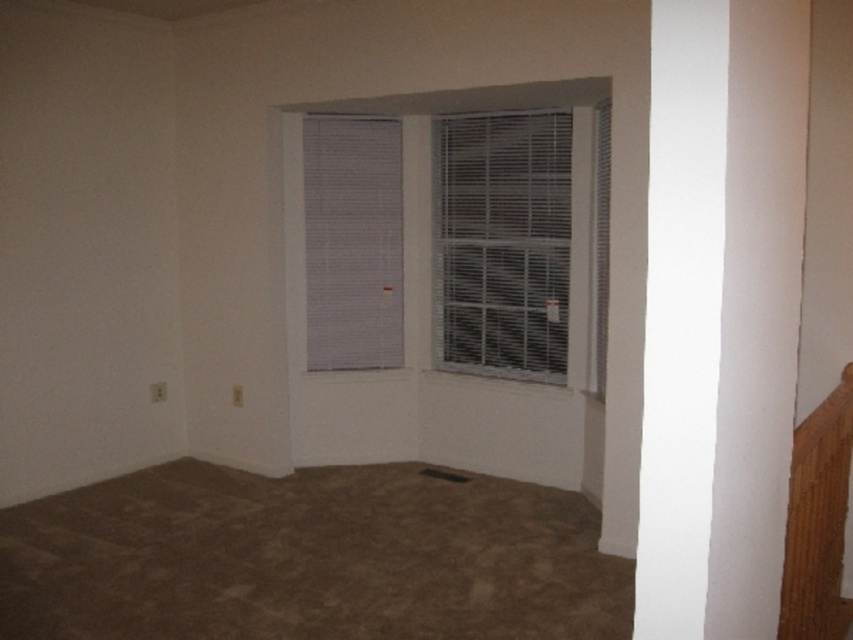
Question: Which point is farther from the camera taking this photo?

Choices:
 (A) (374, 195)
 (B) (596, 346)

Answer: (A)

Question: Does white plastic blinds at center have a smaller size compared to white textured blinds at upper center?

Choices:
 (A) yes
 (B) no

Answer: (B)

Question: Which object is positioned closest to the white textured blind at center?

Choices:
 (A) white textured blinds at upper center
 (B) white plastic blinds at center

Answer: (B)

Question: Is white textured blinds at upper center in front of white textured blind at center?

Choices:
 (A) yes
 (B) no

Answer: (B)

Question: Among these points, which one is farthest from the camera?

Choices:
 (A) (338, 176)
 (B) (444, 212)

Answer: (B)

Question: Does white plastic blinds at center appear under white textured blind at center?

Choices:
 (A) no
 (B) yes

Answer: (A)